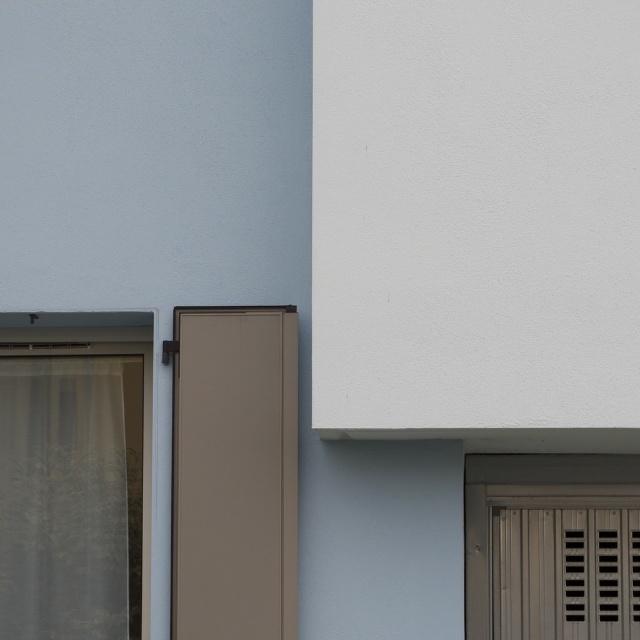
Which of these two, matte brown screen door at center or sheer white curtain at left, stands shorter?

sheer white curtain at left is shorter.

Who is taller, matte brown screen door at center or sheer white curtain at left?

Standing taller between the two is matte brown screen door at center.

Find the location of `matte brown screen door at center`. matte brown screen door at center is located at coordinates (234, 474).

From the picture: Between sheer white curtain at left and matte gray slatted door at lower right, which one is positioned lower?

Positioned lower is sheer white curtain at left.

Is point (132, 492) more distant than point (595, 481)?

Yes, point (132, 492) is farther from viewer.

Where is `sheer white curtain at left`? The height and width of the screenshot is (640, 640). sheer white curtain at left is located at coordinates (68, 499).

Who is more distant from viewer, [291,490] or [593,477]?

Point [593,477]

Can you confirm if matte brown screen door at center is taller than matte gray slatted door at lower right?

Yes.

Between point (198, 570) and point (634, 460), which one is positioned in front?

Point (198, 570) is in front.

In order to click on matte brown screen door at center in this screenshot , I will do `click(234, 474)`.